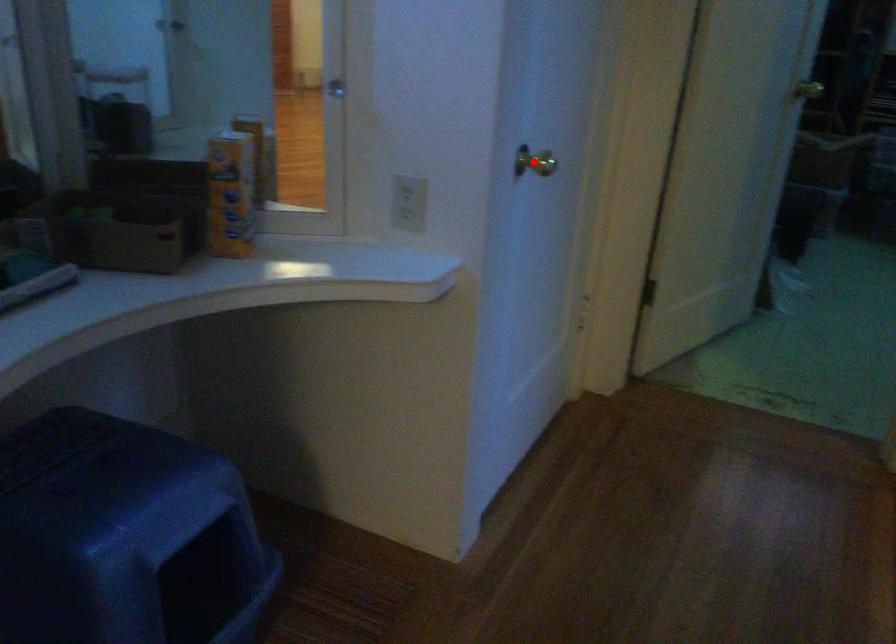
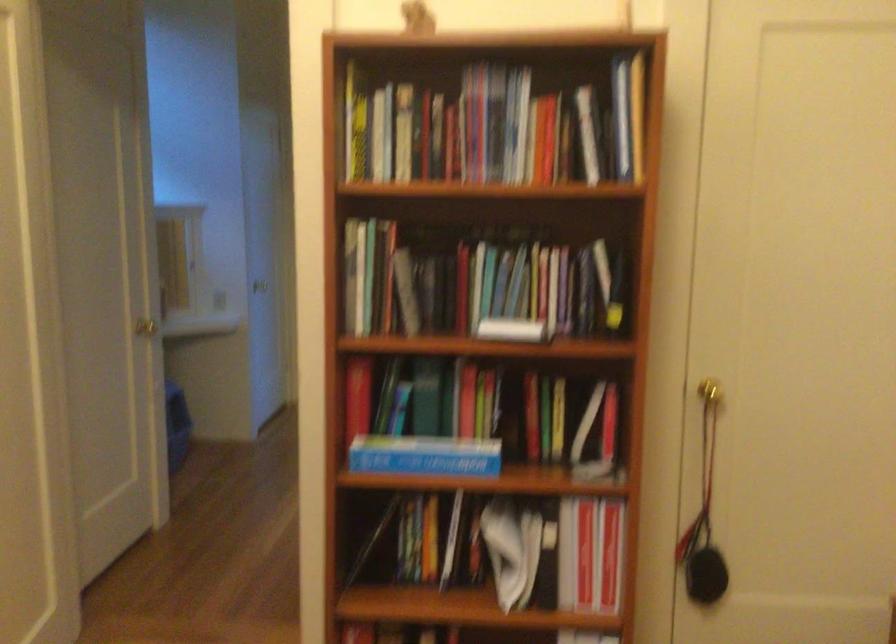
Question: I am providing you with two images of the same scene from different viewpoints. A red point is marked on the first image. At the location where the point appears in image 1, is it still visible in image 2?

Choices:
 (A) Yes
 (B) No

Answer: (B)